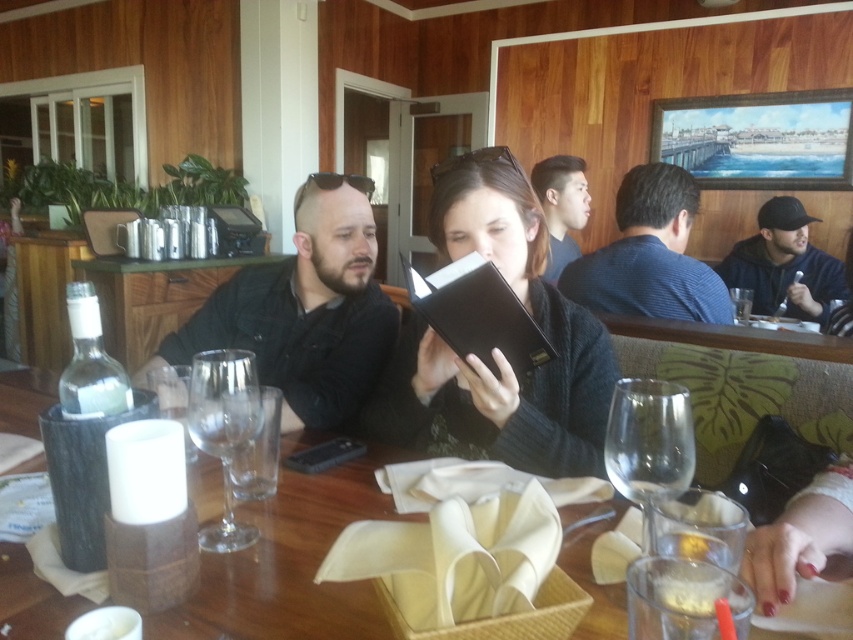
Question: Which object is the farthest from the smooth black hair at upper center?

Choices:
 (A) clear glass bottle at left
 (B) dark blue hoodie at right
 (C) dark gray flannel shirt at center
 (D) black matte book at center

Answer: (A)

Question: Is transparent glass wine glass at center positioned before transparent glass wine glass at table center?

Choices:
 (A) no
 (B) yes

Answer: (B)

Question: Which point appears farthest from the camera in this image?

Choices:
 (A) (764, 237)
 (B) (305, 378)
 (C) (180, 304)
 (D) (670, 413)

Answer: (A)

Question: Estimate the real-world distances between objects in this image. Which object is farther from the smooth black hair at upper center?

Choices:
 (A) dark blue sweater at center
 (B) clear glass at left
 (C) transparent glass wine glass at table center

Answer: (C)

Question: Is dark blue hoodie at right further to the viewer compared to clear glass bottle at left?

Choices:
 (A) yes
 (B) no

Answer: (A)

Question: Observing the image, what is the correct spatial positioning of dark blue sweater at center in reference to dark blue hoodie at right?

Choices:
 (A) above
 (B) below

Answer: (B)